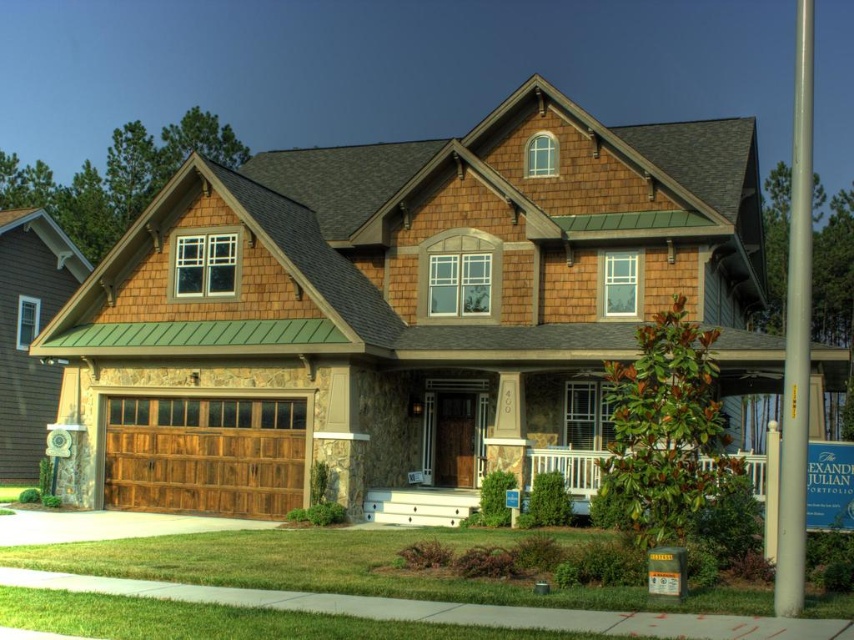
Is point (547, 244) behind point (182, 397)?

Yes, it is behind point (182, 397).

Does wooden garage door at left appear under wooden at left?

Incorrect, wooden garage door at left is not positioned below wooden at left.

What do you see at coordinates (401, 308) in the screenshot?
I see `wooden garage door at left` at bounding box center [401, 308].

The image size is (854, 640). In order to click on wooden garage door at left in this screenshot , I will do pos(401,308).

Is wooden at left to the left of white stone porch at center from the viewer's perspective?

Indeed, wooden at left is positioned on the left side of white stone porch at center.

This screenshot has width=854, height=640. What do you see at coordinates (203, 454) in the screenshot?
I see `wooden at left` at bounding box center [203, 454].

Is point (178, 509) behind point (574, 470)?

Yes, point (178, 509) is behind point (574, 470).

Where is `wooden at left`? The image size is (854, 640). wooden at left is located at coordinates [203, 454].

Looking at this image, between wooden garage door at left and white stone porch at center, which one appears on the right side from the viewer's perspective?

white stone porch at center

Is point (490, 403) farther from camera compared to point (581, 490)?

Yes.

Find the location of a particular element. wooden garage door at left is located at coordinates (401, 308).